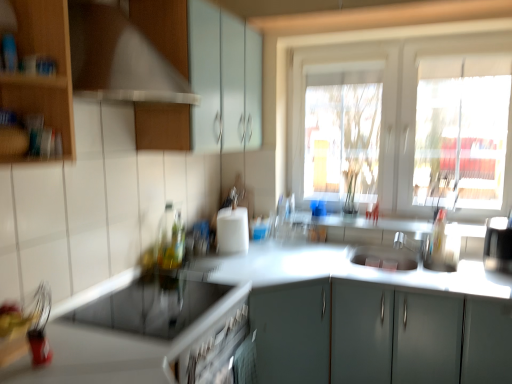
Question: Is silver metallic faucet at center far away from wooden cabinet at left, marked as the second cabinetry in a top-to-bottom arrangement?

Choices:
 (A) no
 (B) yes

Answer: (B)

Question: Is silver metallic faucet at center shorter than wooden cabinet at left, marked as the second cabinetry in a top-to-bottom arrangement?

Choices:
 (A) no
 (B) yes

Answer: (B)

Question: Can you confirm if silver metallic faucet at center is positioned to the left of wooden cabinet at left, marked as the second cabinetry in a top-to-bottom arrangement?

Choices:
 (A) yes
 (B) no

Answer: (B)

Question: Is silver metallic faucet at center smaller than wooden cabinet at left, marked as the first cabinetry in a left-to-right arrangement?

Choices:
 (A) no
 (B) yes

Answer: (B)

Question: Is wooden cabinet at left, which ranks as the 2th cabinetry in bottom-to-top order, surrounded by silver metallic faucet at center?

Choices:
 (A) yes
 (B) no

Answer: (B)

Question: Visually, is sleek silver coffee machine at right positioned to the left or to the right of wooden at left?

Choices:
 (A) right
 (B) left

Answer: (A)

Question: Considering the positions of sleek silver coffee machine at right and wooden at left in the image, is sleek silver coffee machine at right bigger or smaller than wooden at left?

Choices:
 (A) small
 (B) big

Answer: (A)

Question: Considering their positions, is sleek silver coffee machine at right located in front of or behind wooden at left?

Choices:
 (A) behind
 (B) front

Answer: (A)

Question: From the image's perspective, relative to wooden at left, is sleek silver coffee machine at right above or below?

Choices:
 (A) above
 (B) below

Answer: (B)

Question: Is point (305, 309) positioned closer to the camera than point (234, 124)?

Choices:
 (A) farther
 (B) closer

Answer: (B)

Question: Is matte gray cabinet at center, the first cabinetry from the bottom, wider or thinner than matte white cabinet at upper center, which is the 2th cabinetry from left to right?

Choices:
 (A) thin
 (B) wide

Answer: (B)

Question: Relative to matte white cabinet at upper center, arranged as the 1th cabinetry when viewed from the top, is matte gray cabinet at center, placed as the 3th cabinetry when sorted from top to bottom, in front or behind?

Choices:
 (A) front
 (B) behind

Answer: (A)

Question: Based on their positions, is matte gray cabinet at center, which appears as the third cabinetry when viewed from the left, located to the left or right of matte white cabinet at upper center, which is the 2th cabinetry from left to right?

Choices:
 (A) right
 (B) left

Answer: (A)

Question: Considering the positions of wooden cabinet at left, marked as the first cabinetry in a left-to-right arrangement, and white glossy countertop at center, which ranks as the second countertop in top-to-bottom order, in the image, is wooden cabinet at left, marked as the first cabinetry in a left-to-right arrangement, taller or shorter than white glossy countertop at center, which ranks as the second countertop in top-to-bottom order,?

Choices:
 (A) tall
 (B) short

Answer: (B)

Question: Is wooden cabinet at left, marked as the first cabinetry in a left-to-right arrangement, to the left or to the right of white glossy countertop at center, which ranks as the second countertop in top-to-bottom order, in the image?

Choices:
 (A) left
 (B) right

Answer: (A)